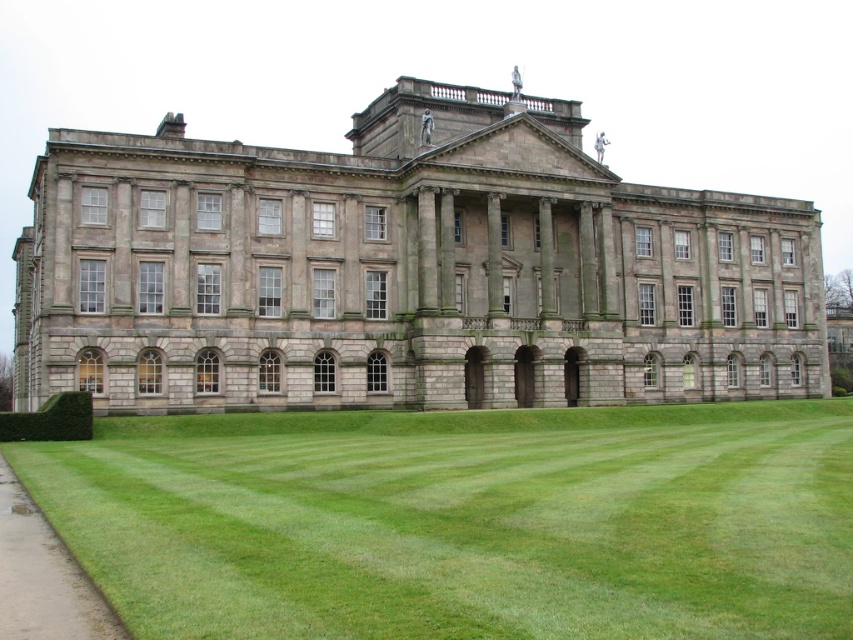
You are standing in front of the grand classical building. You notice the gray stone palace at center and the green grass at lower center. Which object is positioned higher in the image?

The gray stone palace at center is positioned higher than the green grass at lower center.

You are a photographer wanting to capture the gray stone palace at center and the green grass at lower center in a single shot. Which object will appear taller in your photo?

The gray stone palace at center will appear taller in the photo because it has a greater height compared to the green grass at lower center.

You are standing in front of the gray stone palace at center and looking towards the green grass at lower center. Which object is closer to you?

The gray stone palace at center is closer to you since it is positioned further to the viewer than the green grass at lower center.